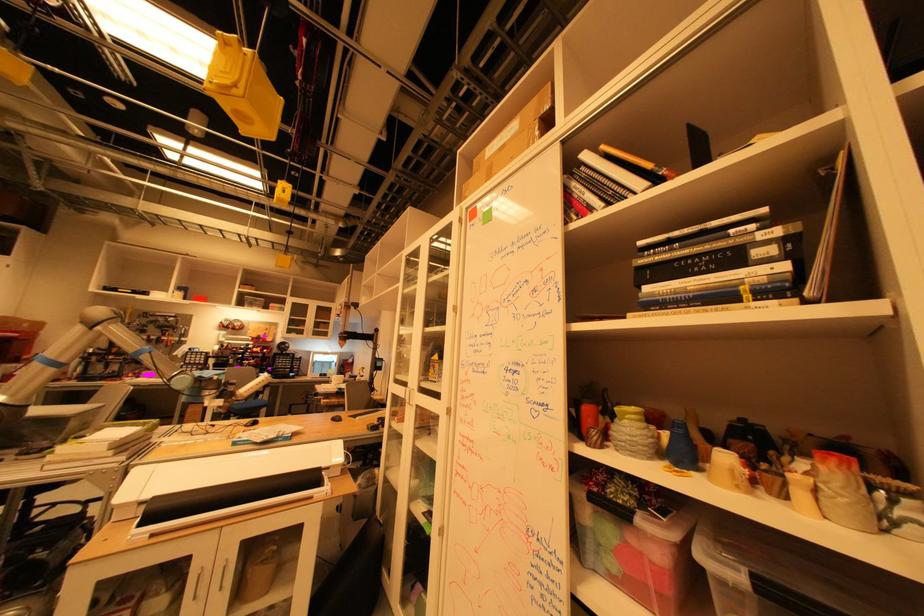
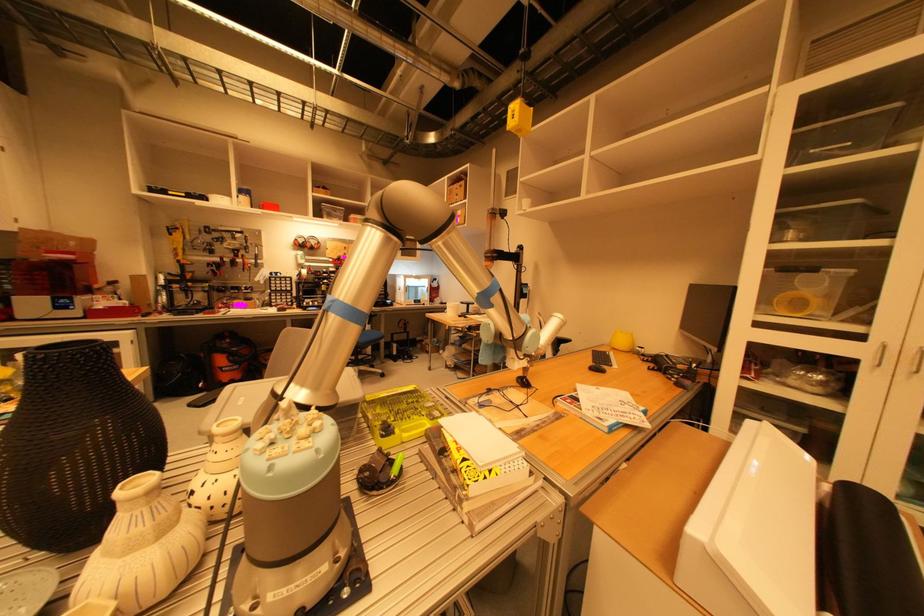
In the second image, find the point that corresponds to pixel 162 338 in the first image.

(235, 260)